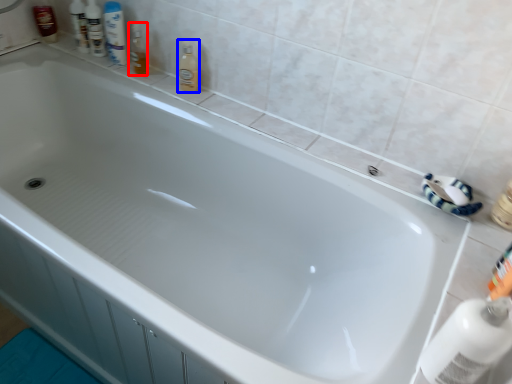
Question: Which point is further to the camera, toiletry (highlighted by a red box) or cleaning product (highlighted by a blue box)?

Choices:
 (A) toiletry
 (B) cleaning product

Answer: (A)